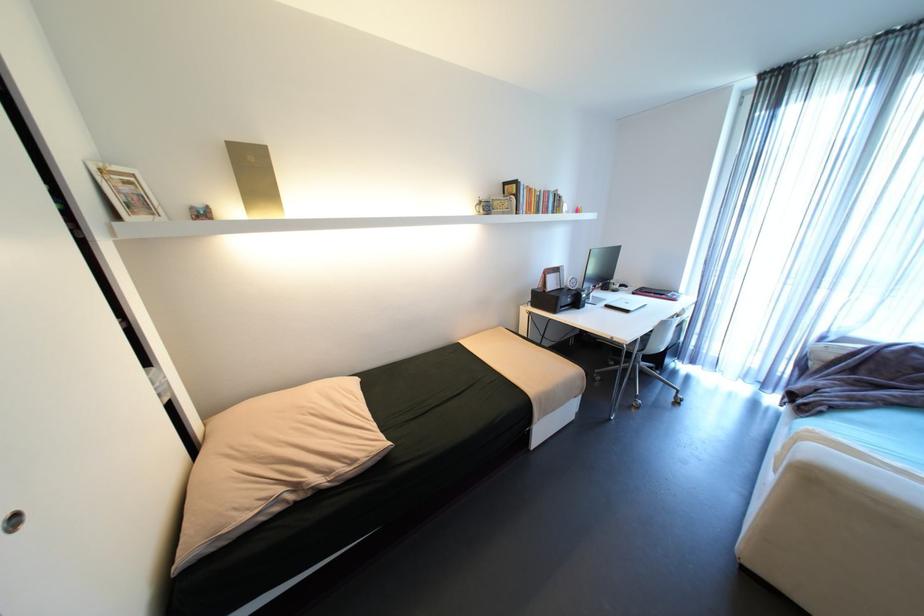
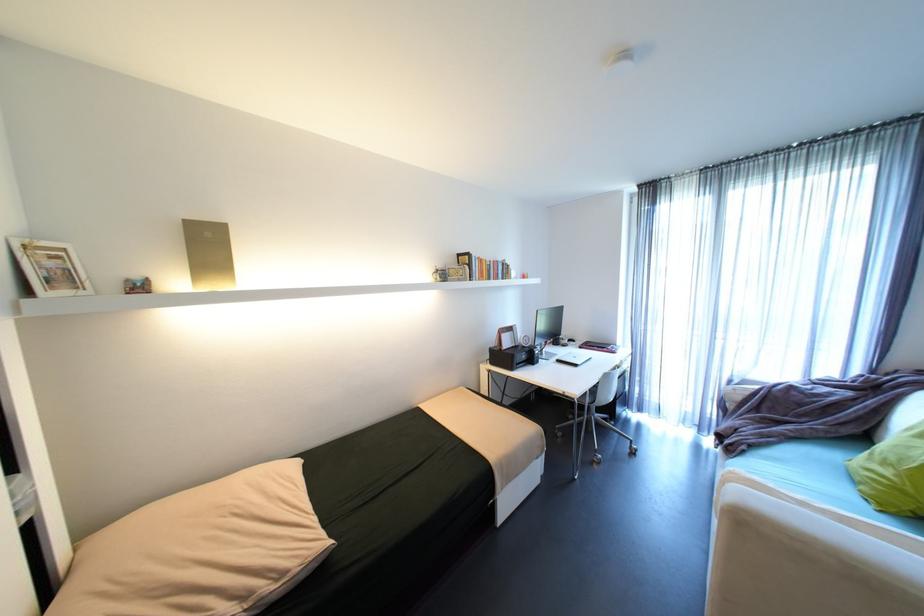
Question: The first image is from the beginning of the video and the second image is from the end. How did the camera likely rotate when shooting the video?

Choices:
 (A) Left
 (B) Right
 (C) Up
 (D) Down

Answer: (C)